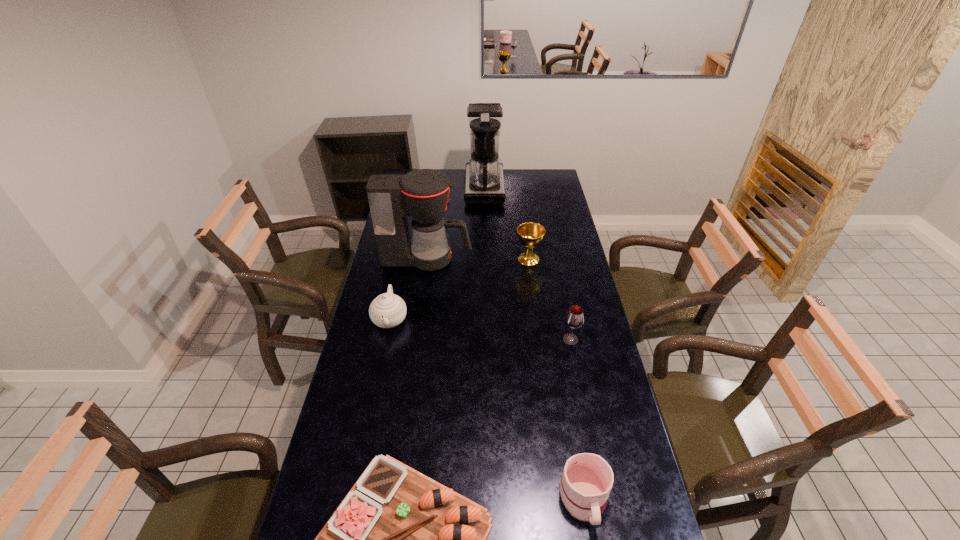
Where is `vacant space at the right edge`? The height and width of the screenshot is (540, 960). vacant space at the right edge is located at coordinates (546, 256).

The image size is (960, 540). I want to click on free space between the second shortest object and the chinaware, so click(x=487, y=408).

At what (x,y) coordinates should I click in order to perform the action: click on vacant area that lies between the chalice and the second shortest object. Please return your answer as a coordinate pair (x, y). This screenshot has width=960, height=540. Looking at the image, I should click on (556, 378).

At what (x,y) coordinates should I click in order to perform the action: click on unoccupied area between the nearer coffee maker and the second shortest object. Please return your answer as a coordinate pair (x, y). The image size is (960, 540). Looking at the image, I should click on (505, 378).

You are a GUI agent. You are given a task and a screenshot of the screen. Output one action in this format:
    pyautogui.click(x=<x>, y=<y>)
    Task: Click on the object that ranks as the third closest to the mug
    The width and height of the screenshot is (960, 540).
    Given the screenshot: What is the action you would take?
    pyautogui.click(x=388, y=310)

This screenshot has height=540, width=960. What are the coordinates of `object that can be found as the closest to the nearer coffee maker` in the screenshot? It's located at (388, 310).

I want to click on vacant space that satisfies the following two spatial constraints: 1. at the front of the chalice where the controls are located; 2. on the left side of the farther coffee maker, so click(x=485, y=259).

The height and width of the screenshot is (540, 960). What are the coordinates of `blank area in the image that satisfies the following two spatial constraints: 1. on the spout of the wineglass; 2. on the right side of the chinaware` in the screenshot? It's located at (386, 340).

The width and height of the screenshot is (960, 540). I want to click on vacant space that satisfies the following two spatial constraints: 1. pour from the carafe of the nearer coffee maker; 2. on the spout of the chinaware, so click(418, 319).

Identify the location of free space that satisfies the following two spatial constraints: 1. on the back side of the wineglass; 2. at the front of the farther coffee maker where the controls are located. (540, 187).